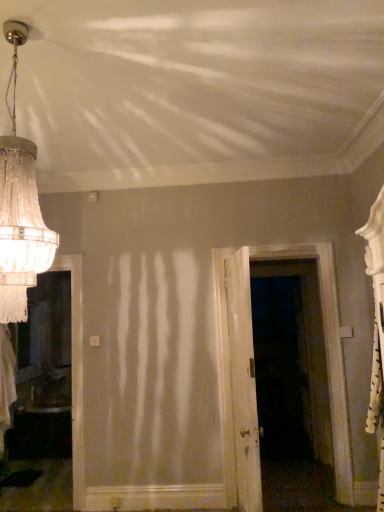
In order to face white wooden door at center, which ranks as the 1th door in right-to-left order, should I rotate leftwards or rightwards?

Rotate right and turn 12.083 degrees.

Locate an element on the screen. The height and width of the screenshot is (512, 384). crystal glass chandelier at upper left is located at coordinates (20, 209).

Locate an element on the screen. This screenshot has width=384, height=512. white wood door at center, which is counted as the first door, starting from the left is located at coordinates (243, 381).

Considering the sizes of objects white wood door at center, which is counted as the first door, starting from the left, and white wooden door at center, which ranks as the 1th door in right-to-left order, in the image provided, who is bigger, white wood door at center, which is counted as the first door, starting from the left, or white wooden door at center, which ranks as the 1th door in right-to-left order,?

white wooden door at center, which ranks as the 1th door in right-to-left order.

Considering the sizes of objects white wood door at center, the second door positioned from the right, and white wooden door at center, acting as the second door starting from the left, in the image provided, who is taller, white wood door at center, the second door positioned from the right, or white wooden door at center, acting as the second door starting from the left,?

Standing taller between the two is white wooden door at center, acting as the second door starting from the left.

Based on the photo, considering the relative positions of white wood door at center, the second door positioned from the right, and white wooden door at center, acting as the second door starting from the left, in the image provided, is white wood door at center, the second door positioned from the right, to the right of white wooden door at center, acting as the second door starting from the left, from the viewer's perspective?

Incorrect, white wood door at center, the second door positioned from the right, is not on the right side of white wooden door at center, acting as the second door starting from the left.

Could white wooden door at center, acting as the second door starting from the left, be considered to be inside white wood door at center, which is counted as the first door, starting from the left?

No.

Is white wood door at center, the second door positioned from the right, inside or outside of crystal glass chandelier at upper left?

white wood door at center, the second door positioned from the right, exists outside the volume of crystal glass chandelier at upper left.

Does white wood door at center, the second door positioned from the right, turn towards crystal glass chandelier at upper left?

No.

From a real-world perspective, which object stands above the other?

From a 3D spatial view, white wooden door at center, acting as the second door starting from the left, is above.

Looking at this image, can you tell me how much white wooden door at center, acting as the second door starting from the left, and white wood door at center, the second door positioned from the right, differ in facing direction?

white wooden door at center, acting as the second door starting from the left, and white wood door at center, the second door positioned from the right, are facing 97.9 degrees away from each other.

Is white wood door at center, the second door positioned from the right, at the back of white wooden door at center, acting as the second door starting from the left?

No, white wooden door at center, acting as the second door starting from the left, is not facing away from white wood door at center, the second door positioned from the right.

Between white wooden door at center, acting as the second door starting from the left, and white wood door at center, which is counted as the first door, starting from the left, which one has more height?

Standing taller between the two is white wooden door at center, acting as the second door starting from the left.

Image resolution: width=384 pixels, height=512 pixels. Identify the location of lamp in front of the white wooden door at center, acting as the second door starting from the left. (20, 209).

Which point is more forward, (7, 149) or (250, 301)?

The point (7, 149) is closer to the camera.

In terms of width, does crystal glass chandelier at upper left look wider or thinner when compared to white wooden door at center, which ranks as the 1th door in right-to-left order?

In the image, crystal glass chandelier at upper left appears to be wider than white wooden door at center, which ranks as the 1th door in right-to-left order.

Which object is positioned more to the right, crystal glass chandelier at upper left or white wooden door at center, acting as the second door starting from the left?

Positioned to the right is white wooden door at center, acting as the second door starting from the left.

Is white wood door at center, which is counted as the first door, starting from the left, surrounded by crystal glass chandelier at upper left?

Definitely not — white wood door at center, which is counted as the first door, starting from the left, is not inside crystal glass chandelier at upper left.

Does crystal glass chandelier at upper left have a lesser height compared to white wood door at center, which is counted as the first door, starting from the left?

Correct, crystal glass chandelier at upper left is not as tall as white wood door at center, which is counted as the first door, starting from the left.

Between crystal glass chandelier at upper left and white wood door at center, which is counted as the first door, starting from the left, which one appears on the right side from the viewer's perspective?

Positioned to the right is white wood door at center, which is counted as the first door, starting from the left.

From a real-world perspective, is crystal glass chandelier at upper left over white wood door at center, which is counted as the first door, starting from the left?

Yes, from a real-world perspective, crystal glass chandelier at upper left is above white wood door at center, which is counted as the first door, starting from the left.

Is white wooden door at center, which ranks as the 1th door in right-to-left order, at the right side of crystal glass chandelier at upper left?

Yes.

From the image's perspective, is white wooden door at center, which ranks as the 1th door in right-to-left order, located beneath crystal glass chandelier at upper left?

Yes.

Based on the photo, could you measure the distance between white wooden door at center, which ranks as the 1th door in right-to-left order, and crystal glass chandelier at upper left?

They are 2.38 meters apart.

This screenshot has width=384, height=512. What are the coordinates of `door below the white wooden door at center, acting as the second door starting from the left (from a real-world perspective)` in the screenshot? It's located at (243, 381).

This screenshot has width=384, height=512. Identify the location of lamp that appears in front of the white wood door at center, the second door positioned from the right. (20, 209).

Estimate the real-world distances between objects in this image. Which object is further from white wood door at center, which is counted as the first door, starting from the left, crystal glass chandelier at upper left or white wooden door at center, which ranks as the 1th door in right-to-left order?

The object further to white wood door at center, which is counted as the first door, starting from the left, is crystal glass chandelier at upper left.

When comparing their distances from crystal glass chandelier at upper left, does white wood door at center, which is counted as the first door, starting from the left, or white wooden door at center, which ranks as the 1th door in right-to-left order, seem further?

The object further to crystal glass chandelier at upper left is white wooden door at center, which ranks as the 1th door in right-to-left order.

Considering their positions, is white wooden door at center, acting as the second door starting from the left, positioned closer to crystal glass chandelier at upper left than white wood door at center, which is counted as the first door, starting from the left?

white wood door at center, which is counted as the first door, starting from the left, is closer to crystal glass chandelier at upper left.

Based on their spatial positions, is white wooden door at center, acting as the second door starting from the left, or crystal glass chandelier at upper left further from white wood door at center, the second door positioned from the right?

Based on the image, crystal glass chandelier at upper left appears to be further to white wood door at center, the second door positioned from the right.

Consider the image. When comparing their distances from white wooden door at center, acting as the second door starting from the left, does white wood door at center, the second door positioned from the right, or crystal glass chandelier at upper left seem closer?

The object closer to white wooden door at center, acting as the second door starting from the left, is white wood door at center, the second door positioned from the right.

Considering their positions, is crystal glass chandelier at upper left positioned further to white wooden door at center, which ranks as the 1th door in right-to-left order, than white wood door at center, which is counted as the first door, starting from the left?

The object further to white wooden door at center, which ranks as the 1th door in right-to-left order, is crystal glass chandelier at upper left.

The width and height of the screenshot is (384, 512). Find the location of `door located between crystal glass chandelier at upper left and white wooden door at center, which ranks as the 1th door in right-to-left order, in the depth direction`. door located between crystal glass chandelier at upper left and white wooden door at center, which ranks as the 1th door in right-to-left order, in the depth direction is located at coordinates (243, 381).